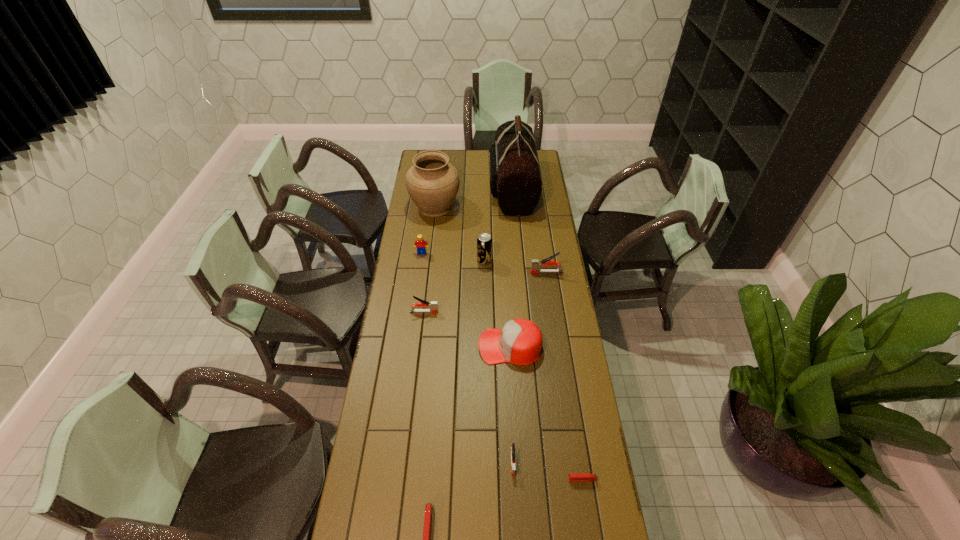
The image size is (960, 540). I want to click on free location located 0.140m on the handle side of the smallest gray stapler, so click(x=516, y=524).

Where is `free space located on the front-facing side of the second nearest object`? The height and width of the screenshot is (540, 960). free space located on the front-facing side of the second nearest object is located at coordinates (530, 479).

Find the location of a particular element. The width and height of the screenshot is (960, 540). free space located 0.090m on the front-facing side of the second nearest object is located at coordinates (540, 479).

The height and width of the screenshot is (540, 960). What are the coordinates of `free space located on the front-facing side of the second nearest object` in the screenshot? It's located at (455, 479).

This screenshot has height=540, width=960. In order to click on object that is at the far edge in this screenshot , I will do `click(515, 180)`.

Locate an element on the screen. The height and width of the screenshot is (540, 960). urn at the left edge is located at coordinates click(432, 182).

Where is `Lego that is at the left edge`? Lego that is at the left edge is located at coordinates (420, 242).

The image size is (960, 540). Find the location of `stapler located at the left edge`. stapler located at the left edge is located at coordinates (433, 305).

What are the coordinates of `duffel bag that is at the right edge` in the screenshot? It's located at (515, 180).

The height and width of the screenshot is (540, 960). Find the location of `baseball cap that is at the right edge`. baseball cap that is at the right edge is located at coordinates (520, 341).